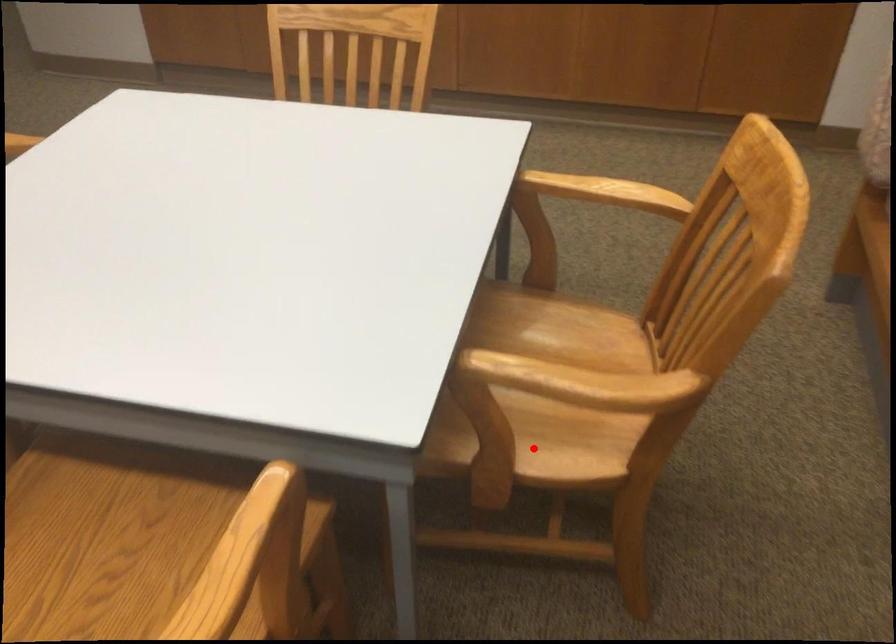
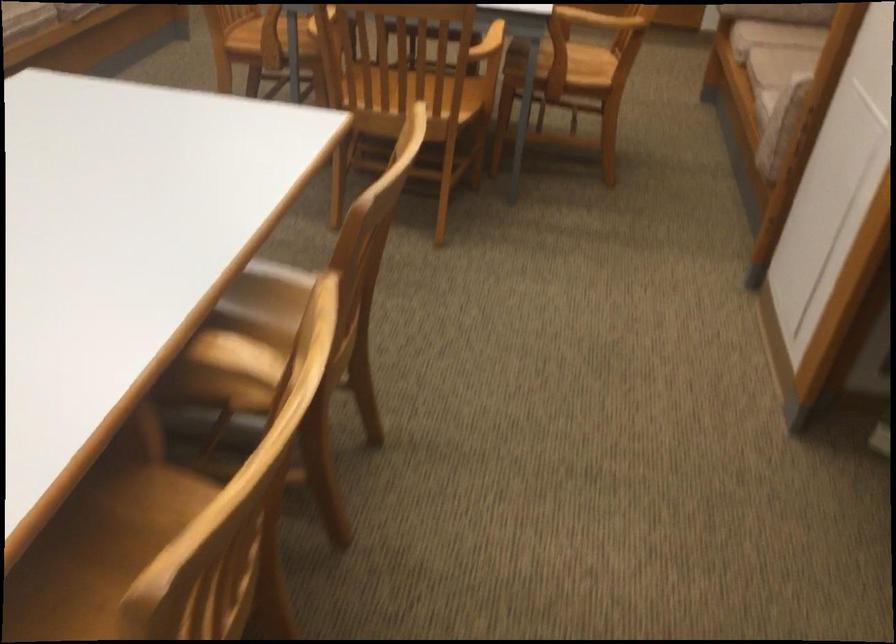
In the second image, find the point that corresponds to the highlighted location in the first image.

(570, 69)